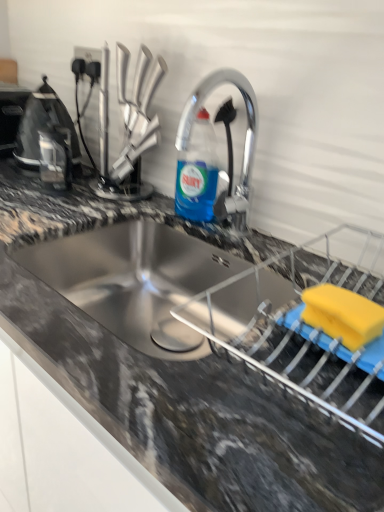
Question: From a real-world perspective, is yellow sponge at lower right, which is the 3th appliance from back to front, positioned above or below black plastic toaster at left, placed as the 1th appliance when sorted from top to bottom?

Choices:
 (A) above
 (B) below

Answer: (B)

Question: In terms of width, does yellow sponge at lower right, the 3th appliance viewed from the top, look wider or thinner when compared to black plastic toaster at left, arranged as the third appliance when viewed from the right?

Choices:
 (A) thin
 (B) wide

Answer: (B)

Question: Which object is positioned closest to the metallic silver faucet at upper center?

Choices:
 (A) granite gray countertop at center
 (B) yellow sponge at lower right, acting as the first appliance starting from the right
 (C) blue translucent liquid at center
 (D) black plastic toaster at left, placed as the 1th appliance when sorted from top to bottom
 (E) black plastic kettle at left, arranged as the 2th appliance when viewed from the right

Answer: (C)

Question: Estimate the real-world distances between objects in this image. Which object is closer to the yellow sponge at lower right, acting as the first appliance starting from the right?

Choices:
 (A) black plastic kettle at left, arranged as the 2th appliance when viewed from the back
 (B) metallic silver faucet at upper center
 (C) black plastic toaster at left, positioned as the first appliance in back-to-front order
 (D) granite gray countertop at center
 (E) blue translucent liquid at center

Answer: (D)